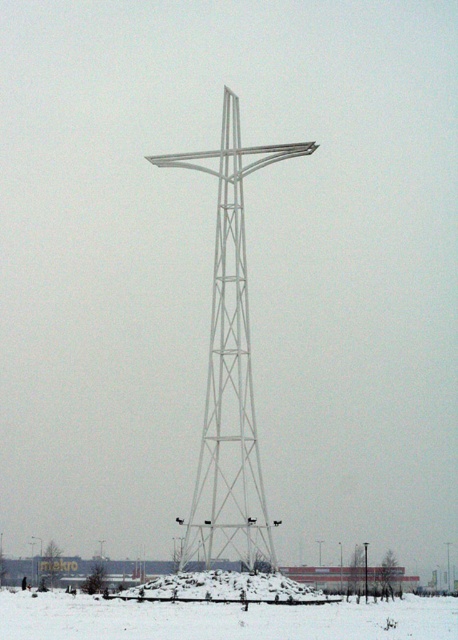
Is the position of white metallic cross at center more distant than that of white powdery snow at center?

Yes, white metallic cross at center is behind white powdery snow at center.

Does white metallic cross at center appear on the right side of white powdery snow at center?

Indeed, white metallic cross at center is positioned on the right side of white powdery snow at center.

The width and height of the screenshot is (458, 640). I want to click on white metallic cross at center, so click(229, 368).

Can you confirm if white powdery snow at center is positioned to the left of white metallic pole at center?

Correct, you'll find white powdery snow at center to the left of white metallic pole at center.

Which is more to the left, white powdery snow at center or white metallic pole at center?

white powdery snow at center

Where is `white powdery snow at center`? This screenshot has width=458, height=640. white powdery snow at center is located at coordinates (222, 618).

Between point (234, 540) and point (365, 557), which one is positioned behind?

Point (365, 557)

Is white metallic cross at center taller than white metallic pole at center?

Indeed, white metallic cross at center has a greater height compared to white metallic pole at center.

Where is `white metallic cross at center`? The height and width of the screenshot is (640, 458). white metallic cross at center is located at coordinates (229, 368).